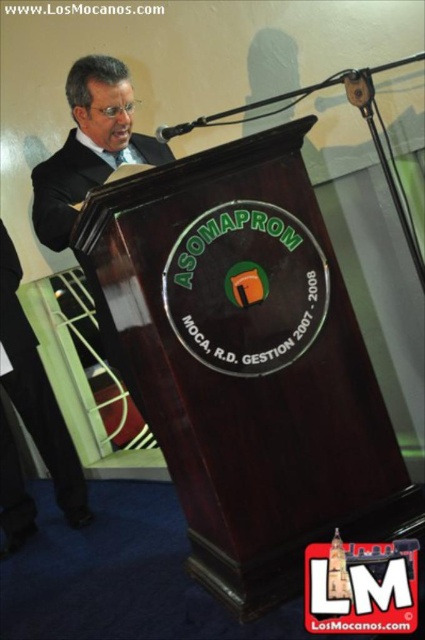
You are an event organizer and need to determine the seating arrangement based on the image provided. Which suit, the matte black suit at left or the black satin business suit at left, is closer to the podium?

The matte black suit at left is closer to the podium because it is in front of the black satin business suit at left.

You are attending a formal event and notice the man in a matte black suit at left. Where is the man positioned relative to the wooden podium?

The matte black suit at left is located at point (88, 147), which places him to the left of the wooden podium.